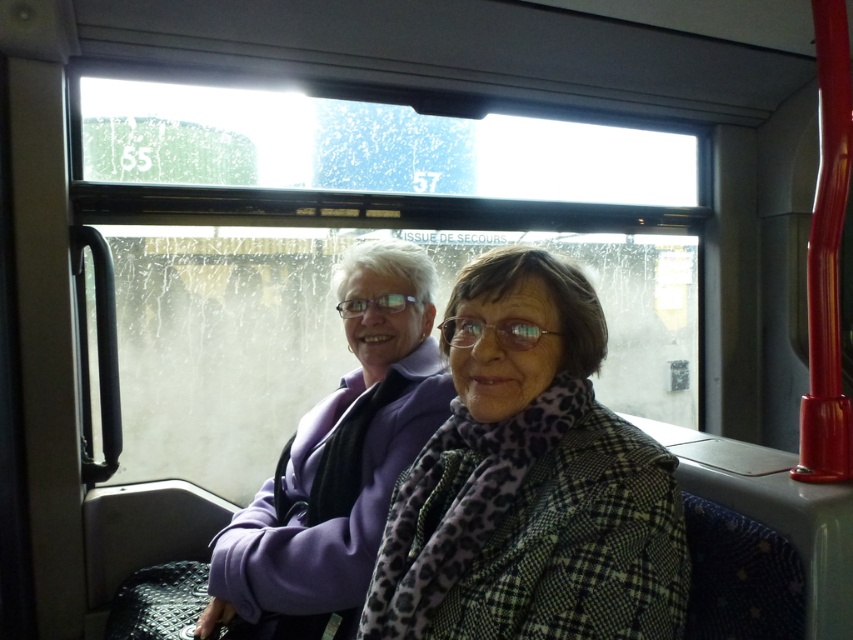
Consider the image. Can you confirm if green checkered coat at center is thinner than purple fabric at center?

Yes, green checkered coat at center is thinner than purple fabric at center.

Does green checkered coat at center have a greater width compared to purple fabric at center?

No.

The image size is (853, 640). What do you see at coordinates (529, 481) in the screenshot? I see `green checkered coat at center` at bounding box center [529, 481].

Where is `green checkered coat at center`? Image resolution: width=853 pixels, height=640 pixels. green checkered coat at center is located at coordinates (529, 481).